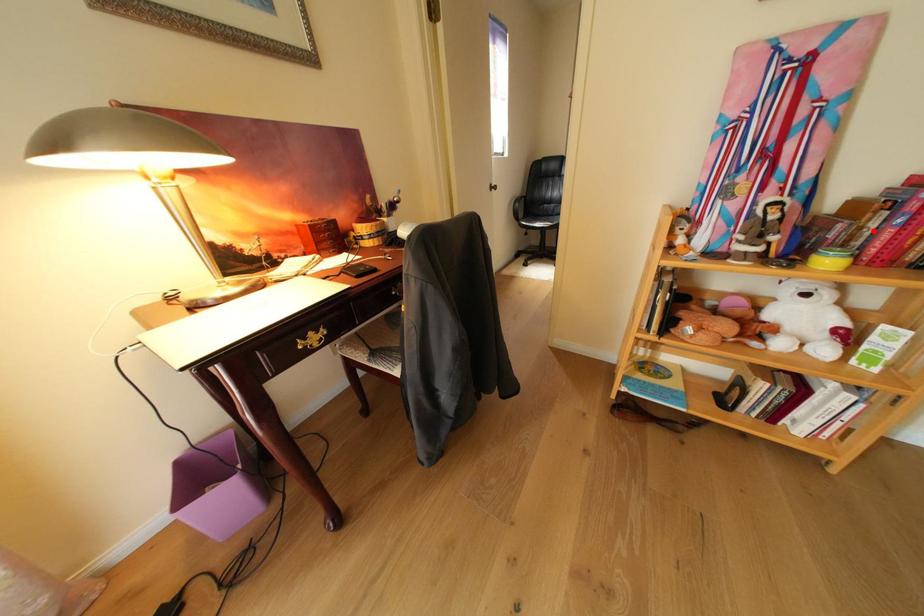
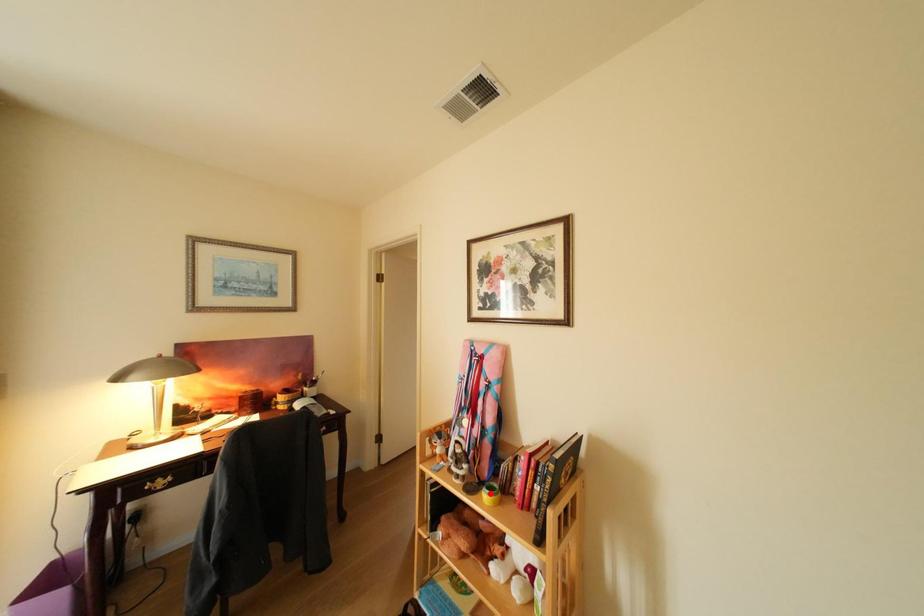
I am providing you with two images of the same scene from different viewpoints. A red point is marked on the first image and another point is marked on the second image. Do the highlighted points in image1 and image2 indicate the same real-world spot?

No